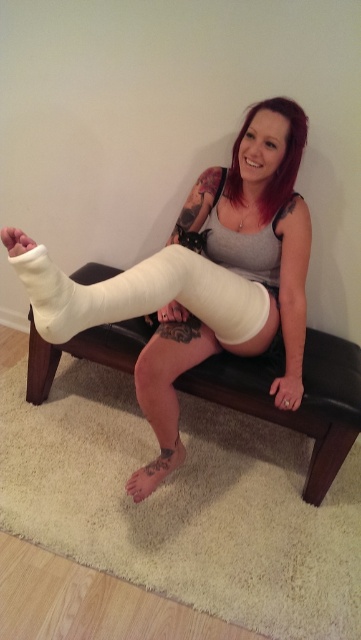
Question: Is white matte bandage at center below smooth skin tattoo at lower center?

Choices:
 (A) yes
 (B) no

Answer: (B)

Question: Can you confirm if white cast at center is bigger than black matte tattoo at lower left?

Choices:
 (A) no
 (B) yes

Answer: (B)

Question: Is matte skin arm at lower center smaller than black matte tattoo at lower left?

Choices:
 (A) yes
 (B) no

Answer: (B)

Question: Which of the following is the farthest from the observer?

Choices:
 (A) (168, 465)
 (B) (146, 490)

Answer: (A)

Question: Which point is farther from the camera taking this photo?

Choices:
 (A) (277, 401)
 (B) (90, 314)
 (C) (140, 493)
 (D) (302, 273)

Answer: (A)

Question: Which point appears closest to the camera in this image?

Choices:
 (A) (151, 481)
 (B) (289, 394)
 (C) (174, 420)

Answer: (C)